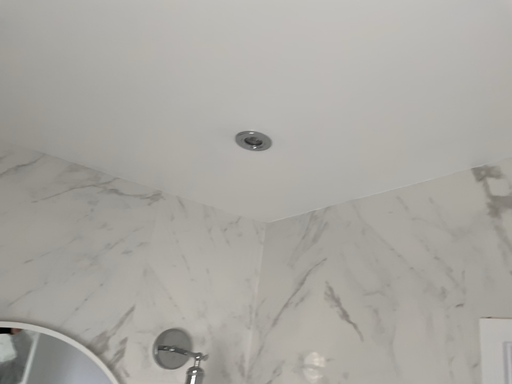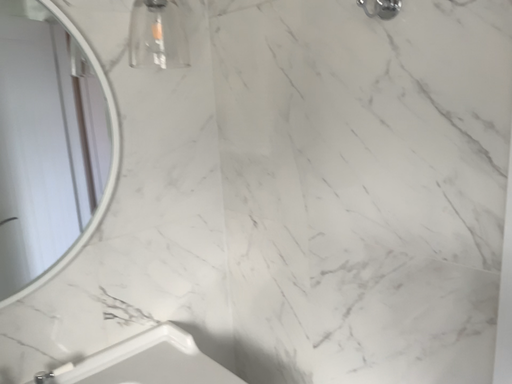
Question: How did the camera likely rotate when shooting the video?

Choices:
 (A) rotated upward
 (B) rotated downward

Answer: (B)